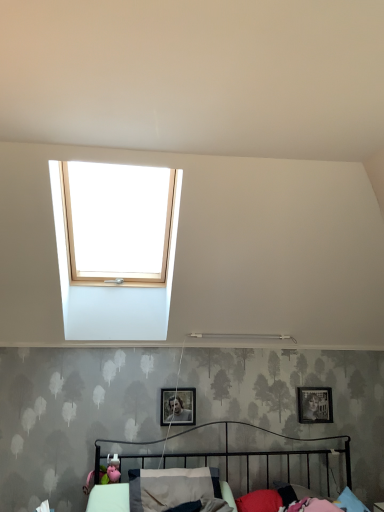
Where is `gray fabric pillow at lower center, the second pillow in the right-to-left sequence`? The image size is (384, 512). gray fabric pillow at lower center, the second pillow in the right-to-left sequence is located at coordinates (171, 487).

Identify the location of metallic silver picture frame at center, marked as the first picture frame in a left-to-right arrangement. This screenshot has height=512, width=384. (178, 406).

What is the approximate width of matte black picture frame at upper right, the second picture frame from the front?

matte black picture frame at upper right, the second picture frame from the front, is 5.47 centimeters wide.

Describe the element at coordinates (260, 501) in the screenshot. I see `red fabric pillow at lower center, the 1th pillow viewed from the right` at that location.

Find the location of a particular element. This screenshot has height=512, width=384. gray fabric pillow at lower center, the second pillow in the right-to-left sequence is located at coordinates (171, 487).

From a real-world perspective, which is physically below, matte black picture frame at upper right, the second picture frame from the front, or metallic black bed at lower center?

metallic black bed at lower center.

Is point (301, 415) closer to viewer compared to point (212, 495)?

No, it is behind (212, 495).

Is metallic silver picture frame at center, the 1th picture frame viewed from the front, positioned behind matte black picture frame at upper right, marked as the 2th picture frame in a left-to-right arrangement?

No, it is in front of matte black picture frame at upper right, marked as the 2th picture frame in a left-to-right arrangement.

Between metallic silver picture frame at center, the second picture frame from the right, and matte black picture frame at upper right, arranged as the 1th picture frame when viewed from the right, which one has larger size?

metallic silver picture frame at center, the second picture frame from the right.

Can you confirm if metallic silver picture frame at center, the second picture frame from the right, is positioned to the left of matte black picture frame at upper right, which is the 1th picture frame from back to front?

Correct, you'll find metallic silver picture frame at center, the second picture frame from the right, to the left of matte black picture frame at upper right, which is the 1th picture frame from back to front.

Would you consider red fabric pillow at lower center, the second pillow viewed from the left, to be distant from matte black picture frame at upper right, the second picture frame from the front?

No, red fabric pillow at lower center, the second pillow viewed from the left, is in close proximity to matte black picture frame at upper right, the second picture frame from the front.

From the image's perspective, is red fabric pillow at lower center, the 1th pillow viewed from the right, beneath matte black picture frame at upper right, the second picture frame from the front?

Yes.

From a real-world perspective, is red fabric pillow at lower center, the 1th pillow viewed from the right, under matte black picture frame at upper right, arranged as the 1th picture frame when viewed from the right?

Correct, in the physical world, red fabric pillow at lower center, the 1th pillow viewed from the right, is lower than matte black picture frame at upper right, arranged as the 1th picture frame when viewed from the right.

Can you tell me how much red fabric pillow at lower center, the second pillow viewed from the left, and matte black picture frame at upper right, which is the 1th picture frame from back to front, differ in facing direction?

The facing directions of red fabric pillow at lower center, the second pillow viewed from the left, and matte black picture frame at upper right, which is the 1th picture frame from back to front, are 14.5 degrees apart.

From the image's perspective, is matte black picture frame at upper right, the second picture frame from the front, under red fabric pillow at lower center, the 1th pillow viewed from the right?

No.

Would you consider matte black picture frame at upper right, arranged as the 1th picture frame when viewed from the right, to be distant from red fabric pillow at lower center, the second pillow viewed from the left?

No, there isn't a large distance between matte black picture frame at upper right, arranged as the 1th picture frame when viewed from the right, and red fabric pillow at lower center, the second pillow viewed from the left.

Considering the relative sizes of matte black picture frame at upper right, which is the 1th picture frame from back to front, and red fabric pillow at lower center, the second pillow viewed from the left, in the image provided, is matte black picture frame at upper right, which is the 1th picture frame from back to front, shorter than red fabric pillow at lower center, the second pillow viewed from the left,?

In fact, matte black picture frame at upper right, which is the 1th picture frame from back to front, may be taller than red fabric pillow at lower center, the second pillow viewed from the left.

Does matte black picture frame at upper right, marked as the 2th picture frame in a left-to-right arrangement, contain red fabric pillow at lower center, the 1th pillow viewed from the right?

That's incorrect, red fabric pillow at lower center, the 1th pillow viewed from the right, is not inside matte black picture frame at upper right, marked as the 2th picture frame in a left-to-right arrangement.

Considering the relative positions of red fabric pillow at lower center, the 1th pillow viewed from the right, and metallic black bed at lower center in the image provided, is red fabric pillow at lower center, the 1th pillow viewed from the right, to the left or to the right of metallic black bed at lower center?

From the image, it's evident that red fabric pillow at lower center, the 1th pillow viewed from the right, is to the right of metallic black bed at lower center.

This screenshot has width=384, height=512. Identify the location of bed on the left of red fabric pillow at lower center, the 1th pillow viewed from the right. (212, 471).

Which point is more distant from viewer, (257, 496) or (129, 497)?

The point (257, 496) is behind.

From a real-world perspective, which object rests below the other?

red fabric pillow at lower center, the 1th pillow viewed from the right.

Is metallic black bed at lower center touching red fabric pillow at lower center, the 1th pillow viewed from the right?

metallic black bed at lower center is not next to red fabric pillow at lower center, the 1th pillow viewed from the right, and they're not touching.

From the image's perspective, is metallic black bed at lower center under red fabric pillow at lower center, the second pillow viewed from the left?

No.

You are a GUI agent. You are given a task and a screenshot of the screen. Output one action in this format:
    pyautogui.click(x=<x>, y=<y>)
    Task: Click on the bed on the left of red fabric pillow at lower center, the second pillow viewed from the left
    
    Given the screenshot: What is the action you would take?
    pyautogui.click(x=212, y=471)

From the image's perspective, which is below, metallic silver picture frame at center, the second picture frame from the right, or red fabric pillow at lower center, the second pillow viewed from the left?

red fabric pillow at lower center, the second pillow viewed from the left, appears lower in the image.

Looking at this image, would you say red fabric pillow at lower center, the second pillow viewed from the left, is part of metallic silver picture frame at center, arranged as the 2th picture frame when viewed from the back,'s contents?

No, red fabric pillow at lower center, the second pillow viewed from the left, is located outside of metallic silver picture frame at center, arranged as the 2th picture frame when viewed from the back.

Is metallic silver picture frame at center, the 1th picture frame viewed from the front, further to camera compared to red fabric pillow at lower center, the 1th pillow viewed from the right?

Yes, metallic silver picture frame at center, the 1th picture frame viewed from the front, is behind red fabric pillow at lower center, the 1th pillow viewed from the right.

Is metallic silver picture frame at center, the second picture frame from the right, wider or thinner than red fabric pillow at lower center, the second pillow viewed from the left?

Considering their sizes, metallic silver picture frame at center, the second picture frame from the right, looks slimmer than red fabric pillow at lower center, the second pillow viewed from the left.

This screenshot has height=512, width=384. In order to click on bed below the matte black picture frame at upper right, marked as the 2th picture frame in a left-to-right arrangement (from a real-world perspective) in this screenshot , I will do `click(212, 471)`.

Identify the location of picture frame that appears behind the metallic silver picture frame at center, marked as the first picture frame in a left-to-right arrangement. (315, 405).

Looking at the image, which one is located closer to gray fabric pillow at lower center, arranged as the 1th pillow when viewed from the left, metallic black bed at lower center or metallic silver picture frame at center, arranged as the 2th picture frame when viewed from the back?

metallic black bed at lower center is positioned closer to the anchor gray fabric pillow at lower center, arranged as the 1th pillow when viewed from the left.

From the image, which object appears to be nearer to matte black picture frame at upper right, the second picture frame from the front, gray fabric pillow at lower center, the second pillow in the right-to-left sequence, or metallic silver picture frame at center, arranged as the 2th picture frame when viewed from the back?

Based on the image, metallic silver picture frame at center, arranged as the 2th picture frame when viewed from the back, appears to be nearer to matte black picture frame at upper right, the second picture frame from the front.

When comparing their distances from gray fabric pillow at lower center, the second pillow in the right-to-left sequence, does metallic black bed at lower center or red fabric pillow at lower center, the second pillow viewed from the left, seem further?

Based on the image, red fabric pillow at lower center, the second pillow viewed from the left, appears to be further to gray fabric pillow at lower center, the second pillow in the right-to-left sequence.

Considering their positions, is red fabric pillow at lower center, the 1th pillow viewed from the right, positioned further to metallic black bed at lower center than matte black picture frame at upper right, the second picture frame from the front?

matte black picture frame at upper right, the second picture frame from the front, lies further to metallic black bed at lower center than the other object.

Which object lies further to the anchor point gray fabric pillow at lower center, arranged as the 1th pillow when viewed from the left, matte black picture frame at upper right, arranged as the 1th picture frame when viewed from the right, or metallic silver picture frame at center, arranged as the 2th picture frame when viewed from the back?

Based on the image, matte black picture frame at upper right, arranged as the 1th picture frame when viewed from the right, appears to be further to gray fabric pillow at lower center, arranged as the 1th pillow when viewed from the left.

Looking at this image, based on their spatial positions, is red fabric pillow at lower center, the second pillow viewed from the left, or gray fabric pillow at lower center, the second pillow in the right-to-left sequence, further from metallic silver picture frame at center, arranged as the 2th picture frame when viewed from the back?

red fabric pillow at lower center, the second pillow viewed from the left, is positioned further to the anchor metallic silver picture frame at center, arranged as the 2th picture frame when viewed from the back.

Estimate the real-world distances between objects in this image. Which object is closer to metallic silver picture frame at center, the 1th picture frame viewed from the front, metallic black bed at lower center or matte black picture frame at upper right, marked as the 2th picture frame in a left-to-right arrangement?

Based on the image, metallic black bed at lower center appears to be nearer to metallic silver picture frame at center, the 1th picture frame viewed from the front.

Considering their positions, is metallic silver picture frame at center, marked as the first picture frame in a left-to-right arrangement, positioned closer to metallic black bed at lower center than red fabric pillow at lower center, the second pillow viewed from the left?

red fabric pillow at lower center, the second pillow viewed from the left, is positioned closer to the anchor metallic black bed at lower center.

Locate an element on the screen. Image resolution: width=384 pixels, height=512 pixels. picture frame between metallic black bed at lower center and matte black picture frame at upper right, which is the 1th picture frame from back to front, along the z-axis is located at coordinates (178, 406).

You are a GUI agent. You are given a task and a screenshot of the screen. Output one action in this format:
    pyautogui.click(x=<x>, y=<y>)
    Task: Click on the pillow located between gray fabric pillow at lower center, the second pillow in the right-to-left sequence, and metallic silver picture frame at center, the second picture frame from the right, in the depth direction
    The width and height of the screenshot is (384, 512).
    Given the screenshot: What is the action you would take?
    [x=260, y=501]

Identify the location of pillow located between gray fabric pillow at lower center, arranged as the 1th pillow when viewed from the left, and matte black picture frame at upper right, the second picture frame from the front, in the left-right direction. (260, 501).

The height and width of the screenshot is (512, 384). What are the coordinates of `pillow between metallic black bed at lower center and red fabric pillow at lower center, the 1th pillow viewed from the right, along the z-axis` in the screenshot? It's located at (171, 487).